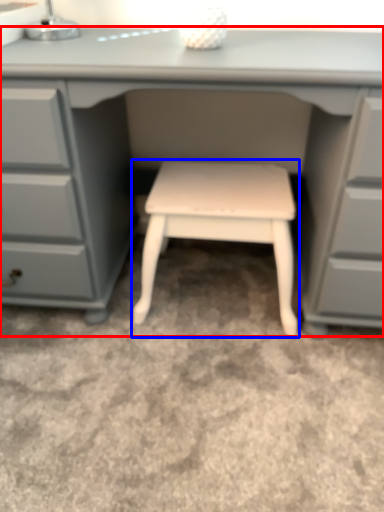
Question: Which object appears closest to the camera in this image, desk (highlighted by a red box) or stool (highlighted by a blue box)?

Choices:
 (A) desk
 (B) stool

Answer: (A)